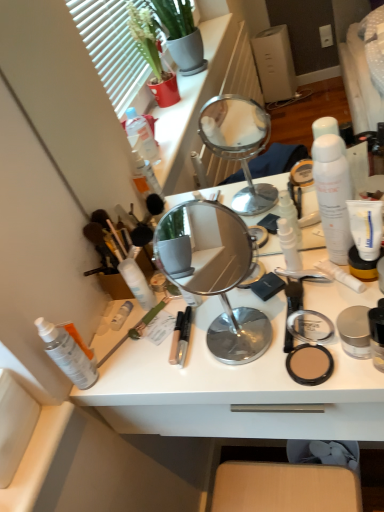
The height and width of the screenshot is (512, 384). I want to click on free space in front of white matte lotion at center, acting as the 2th toiletry starting from the right, so click(x=300, y=329).